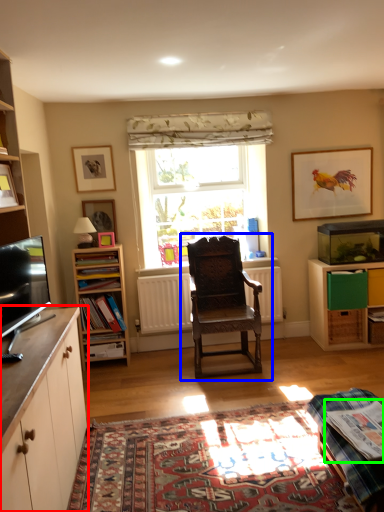
Question: Which object is the closest to the cabinetry (highlighted by a red box)? Choose among these: chair (highlighted by a blue box) or book (highlighted by a green box).

Choices:
 (A) chair
 (B) book

Answer: (B)